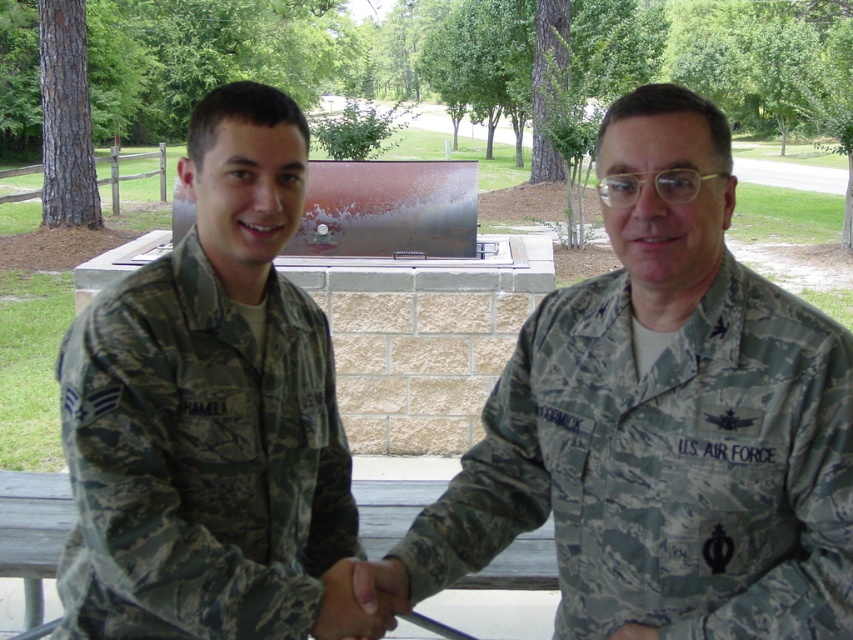
Question: Which point is closer to the camera?

Choices:
 (A) camouflage uniform at center
 (B) camouflage uniform at left

Answer: (A)

Question: Does camouflage uniform at center have a lesser width compared to camouflage uniform at left?

Choices:
 (A) yes
 (B) no

Answer: (B)

Question: From the image, what is the correct spatial relationship of camouflage uniform at center in relation to camouflage uniform at left?

Choices:
 (A) above
 (B) below

Answer: (B)

Question: Can you confirm if camouflage uniform at center is thinner than camouflage uniform at left?

Choices:
 (A) yes
 (B) no

Answer: (B)

Question: Which point appears closest to the camera in this image?

Choices:
 (A) (277, 216)
 (B) (741, 508)

Answer: (B)

Question: Which object is farther from the camera taking this photo?

Choices:
 (A) camouflage uniform at left
 (B) camouflage uniform at center

Answer: (A)